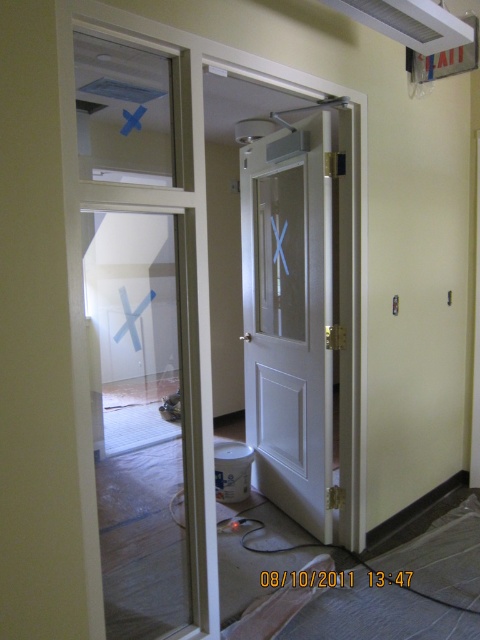
Question: Can you confirm if clear glass door at center is wider than white glossy door at center?

Choices:
 (A) no
 (B) yes

Answer: (B)

Question: Is clear glass door at center wider than white glossy door at center?

Choices:
 (A) no
 (B) yes

Answer: (B)

Question: Among these objects, which one is farthest from the camera?

Choices:
 (A) clear glass door at center
 (B) white glossy door at center

Answer: (B)

Question: Which of the following is the closest to the observer?

Choices:
 (A) (324, 308)
 (B) (137, 467)

Answer: (A)

Question: Which object appears farthest from the camera in this image?

Choices:
 (A) clear glass door at center
 (B) white glossy door at center

Answer: (B)

Question: Is clear glass door at center further to camera compared to white glossy door at center?

Choices:
 (A) no
 (B) yes

Answer: (A)